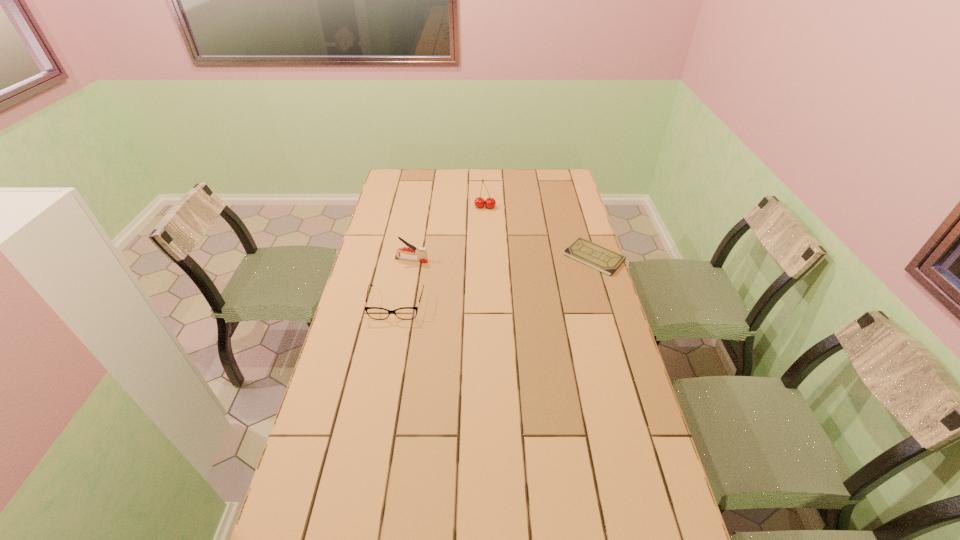
You are a GUI agent. You are given a task and a screenshot of the screen. Output one action in this format:
    pyautogui.click(x=<x>, y=<y>)
    Task: Click on the vacant point at the left edge
    This screenshot has height=540, width=960.
    Given the screenshot: What is the action you would take?
    pyautogui.click(x=360, y=426)

In the image, there is a desktop. Find the location of `vacant space at the right edge`. vacant space at the right edge is located at coordinates (579, 352).

The width and height of the screenshot is (960, 540). In the image, there is a desktop. Find the location of `vacant area at the far left corner`. vacant area at the far left corner is located at coordinates (415, 182).

Locate an element on the screen. free space between the second shortest object and the farthest object is located at coordinates (441, 256).

The width and height of the screenshot is (960, 540). Find the location of `vacant area that lies between the spectacles and the third object from left to right`. vacant area that lies between the spectacles and the third object from left to right is located at coordinates (441, 256).

Where is `vacant space that's between the rightmost object and the farthest object`? The width and height of the screenshot is (960, 540). vacant space that's between the rightmost object and the farthest object is located at coordinates (540, 232).

The height and width of the screenshot is (540, 960). Identify the location of free point between the cherry and the second tallest object. (448, 233).

Where is `vacant area that lies between the cherry and the checkbook`? The width and height of the screenshot is (960, 540). vacant area that lies between the cherry and the checkbook is located at coordinates (540, 232).

The height and width of the screenshot is (540, 960). Identify the location of vacant area that lies between the nearest object and the third shortest object. (404, 282).

At what (x,y) coordinates should I click in order to perform the action: click on vacant area that lies between the nearest object and the shortest object. Please return your answer as a coordinate pair (x, y). Looking at the image, I should click on (495, 281).